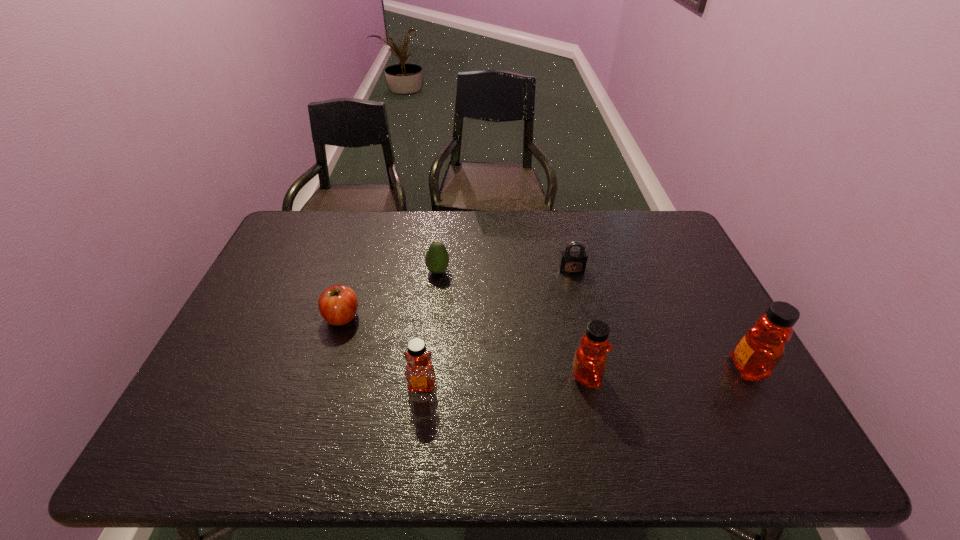
Please point a spot to add another honey on the left. Please provide its 2D coordinates. Your answer should be formatted as a tuple, i.e. [(x, y)], where the tuple contains the x and y coordinates of a point satisfying the conditions above.

[(251, 394)]